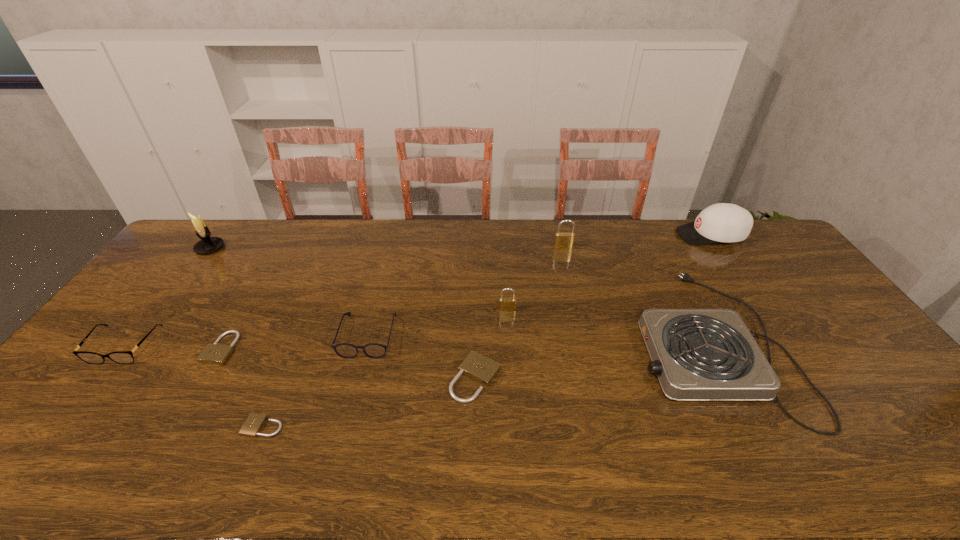
This screenshot has width=960, height=540. In order to click on the tallest object in this screenshot , I will do `click(207, 244)`.

Locate an element on the screen. The height and width of the screenshot is (540, 960). candle holder is located at coordinates (207, 244).

This screenshot has height=540, width=960. Identify the location of baseball cap. (722, 222).

Where is `the rightmost padlock`? This screenshot has height=540, width=960. the rightmost padlock is located at coordinates (564, 240).

Identify the location of the eighth object from left to right. This screenshot has width=960, height=540. (564, 240).

Locate an element on the screen. The width and height of the screenshot is (960, 540). the nearer brass padlock is located at coordinates (505, 304).

Find the location of `the fourth nearest padlock`. the fourth nearest padlock is located at coordinates (505, 304).

Identify the location of hotplate. (697, 354).

Identify the location of the right spectacles. The height and width of the screenshot is (540, 960). (373, 350).

You are a GUI agent. You are given a task and a screenshot of the screen. Output one action in this format:
    pyautogui.click(x=<x>, y=<y>)
    Task: Click on the left spectacles
    This screenshot has width=960, height=540.
    Given the screenshot: What is the action you would take?
    pyautogui.click(x=121, y=357)